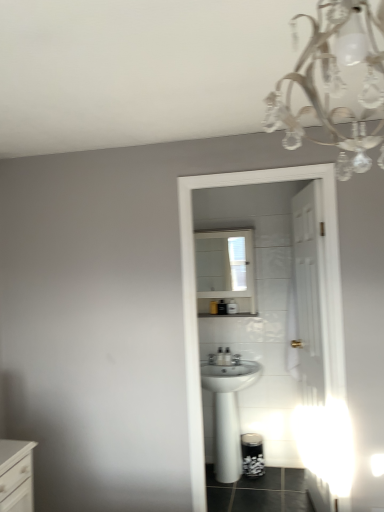
Identify the location of white glossy sink at center. (228, 411).

You are a GUI agent. You are given a task and a screenshot of the screen. Output one action in this format:
    pyautogui.click(x=<x>, y=<y>)
    Task: Click on the clear crystal chandelier at upper right
    Image resolution: width=384 pixels, height=512 pixels.
    Given the screenshot: What is the action you would take?
    pyautogui.click(x=335, y=84)

Describe the element at coordinates (16, 476) in the screenshot. I see `white glossy chest of drawers at lower left` at that location.

The height and width of the screenshot is (512, 384). What do you see at coordinates (225, 268) in the screenshot?
I see `white glossy medicine cabinet at center` at bounding box center [225, 268].

At what (x,y) coordinates should I click in order to perform the action: click on white glossy sink at center. Please return your answer as a coordinate pair (x, y). The image size is (384, 512). Looking at the image, I should click on (228, 411).

From the image's perspective, which one is positioned lower, white glossy chest of drawers at lower left or white glossy medicine cabinet at center?

white glossy chest of drawers at lower left is shown below in the image.

Is white glossy chest of drawers at lower left oriented away from white glossy medicine cabinet at center?

No, white glossy chest of drawers at lower left is not facing the opposite direction of white glossy medicine cabinet at center.

In the scene shown: Considering the relative positions of white glossy chest of drawers at lower left and white glossy medicine cabinet at center in the image provided, is white glossy chest of drawers at lower left to the right of white glossy medicine cabinet at center from the viewer's perspective?

In fact, white glossy chest of drawers at lower left is to the left of white glossy medicine cabinet at center.

Is clear crystal chandelier at upper right oriented towards white glossy medicine cabinet at center?

Yes, clear crystal chandelier at upper right is oriented towards white glossy medicine cabinet at center.

From the image's perspective, which is above, clear crystal chandelier at upper right or white glossy medicine cabinet at center?

clear crystal chandelier at upper right appears higher in the image.

Does clear crystal chandelier at upper right lie behind white glossy medicine cabinet at center?

That is False.

Considering the relative positions of clear crystal chandelier at upper right and white glossy medicine cabinet at center in the image provided, is clear crystal chandelier at upper right to the right of white glossy medicine cabinet at center from the viewer's perspective?

No, clear crystal chandelier at upper right is not to the right of white glossy medicine cabinet at center.

Who is shorter, white glossy sink at center or white glossy chest of drawers at lower left?

Standing shorter between the two is white glossy chest of drawers at lower left.

The width and height of the screenshot is (384, 512). In order to click on sink that is under the white glossy chest of drawers at lower left (from a real-world perspective) in this screenshot , I will do `click(228, 411)`.

Consider the image. In terms of size, does white glossy sink at center appear bigger or smaller than white glossy chest of drawers at lower left?

In the image, white glossy sink at center appears to be larger than white glossy chest of drawers at lower left.

Is point (223, 403) positioned in front of point (26, 476)?

No.

Is white glossy medicine cabinet at center closer to the viewer compared to white glossy chest of drawers at lower left?

No, white glossy medicine cabinet at center is behind white glossy chest of drawers at lower left.

Which object is positioned more to the left, white glossy medicine cabinet at center or white glossy chest of drawers at lower left?

Positioned to the left is white glossy chest of drawers at lower left.

Can you confirm if white glossy medicine cabinet at center is thinner than white glossy chest of drawers at lower left?

Yes.

In the scene shown: Who is taller, white glossy medicine cabinet at center or white glossy chest of drawers at lower left?

Standing taller between the two is white glossy medicine cabinet at center.

From the picture: From the image's perspective, which is above, white glossy sink at center or clear crystal chandelier at upper right?

From the image's view, clear crystal chandelier at upper right is above.

Which object is positioned more to the right, white glossy sink at center or clear crystal chandelier at upper right?

Positioned to the right is white glossy sink at center.

From a real-world perspective, between white glossy sink at center and clear crystal chandelier at upper right, who is vertically higher?

In real-world perspective, clear crystal chandelier at upper right is above.

Measure the distance between white glossy sink at center and clear crystal chandelier at upper right.

A distance of 2.34 meters exists between white glossy sink at center and clear crystal chandelier at upper right.

Is clear crystal chandelier at upper right in front of or behind white glossy sink at center in the image?

In the image, clear crystal chandelier at upper right appears in front of white glossy sink at center.

Based on the photo, is clear crystal chandelier at upper right not inside white glossy sink at center?

Yes.

Identify the location of sink below the clear crystal chandelier at upper right (from a real-world perspective). The height and width of the screenshot is (512, 384). (228, 411).

Is clear crystal chandelier at upper right taller or shorter than white glossy sink at center?

In the image, clear crystal chandelier at upper right appears to be shorter than white glossy sink at center.

How different are the orientations of white glossy medicine cabinet at center and clear crystal chandelier at upper right in degrees?

Answer: The facing directions of white glossy medicine cabinet at center and clear crystal chandelier at upper right are 179 degrees apart.

Consider the image. Which object is closer to the camera, white glossy medicine cabinet at center or clear crystal chandelier at upper right?

clear crystal chandelier at upper right is in front.

Is white glossy medicine cabinet at center spatially inside clear crystal chandelier at upper right, or outside of it?

white glossy medicine cabinet at center is spatially situated outside clear crystal chandelier at upper right.

Can you confirm if white glossy medicine cabinet at center is positioned to the left of clear crystal chandelier at upper right?

In fact, white glossy medicine cabinet at center is to the right of clear crystal chandelier at upper right.

The height and width of the screenshot is (512, 384). Find the location of `chest of drawers below the white glossy medicine cabinet at center (from a real-world perspective)`. chest of drawers below the white glossy medicine cabinet at center (from a real-world perspective) is located at coordinates (16, 476).

You are a GUI agent. You are given a task and a screenshot of the screen. Output one action in this format:
    pyautogui.click(x=<x>, y=<y>)
    Task: Click on the light fixture above the white glossy medicine cabinet at center (from the image's perspective)
    The height and width of the screenshot is (512, 384).
    Given the screenshot: What is the action you would take?
    pyautogui.click(x=335, y=84)

Looking at the image, which one is located closer to white glossy chest of drawers at lower left, clear crystal chandelier at upper right or white glossy sink at center?

Based on the image, white glossy sink at center appears to be nearer to white glossy chest of drawers at lower left.

Estimate the real-world distances between objects in this image. Which object is further from white glossy medicine cabinet at center, white glossy sink at center or white glossy chest of drawers at lower left?

Among the two, white glossy chest of drawers at lower left is located further to white glossy medicine cabinet at center.

Which object lies further to the anchor point clear crystal chandelier at upper right, white glossy chest of drawers at lower left or white glossy sink at center?

white glossy sink at center is further to clear crystal chandelier at upper right.

Estimate the real-world distances between objects in this image. Which object is further from white glossy sink at center, clear crystal chandelier at upper right or white glossy chest of drawers at lower left?

Among the two, clear crystal chandelier at upper right is located further to white glossy sink at center.

Estimate the real-world distances between objects in this image. Which object is closer to white glossy medicine cabinet at center, white glossy chest of drawers at lower left or white glossy sink at center?

The object closer to white glossy medicine cabinet at center is white glossy sink at center.

From the image, which object appears to be nearer to clear crystal chandelier at upper right, white glossy chest of drawers at lower left or white glossy medicine cabinet at center?

white glossy chest of drawers at lower left.

From the picture: Which object lies nearer to the anchor point white glossy chest of drawers at lower left, white glossy medicine cabinet at center or clear crystal chandelier at upper right?

Based on the image, clear crystal chandelier at upper right appears to be nearer to white glossy chest of drawers at lower left.

Estimate the real-world distances between objects in this image. Which object is further from clear crystal chandelier at upper right, white glossy sink at center or white glossy medicine cabinet at center?

white glossy medicine cabinet at center lies further to clear crystal chandelier at upper right than the other object.

At what (x,y) coordinates should I click in order to perform the action: click on the chest of drawers positioned between clear crystal chandelier at upper right and white glossy sink at center from near to far. Please return your answer as a coordinate pair (x, y). Looking at the image, I should click on (16, 476).

Locate an element on the screen. This screenshot has width=384, height=512. chest of drawers between clear crystal chandelier at upper right and white glossy medicine cabinet at center from front to back is located at coordinates (16, 476).

At what (x,y) coordinates should I click in order to perform the action: click on medicine cabinet located between white glossy chest of drawers at lower left and white glossy sink at center in the left-right direction. Please return your answer as a coordinate pair (x, y). This screenshot has height=512, width=384. Looking at the image, I should click on (225, 268).

Find the location of a particular element. sink positioned between clear crystal chandelier at upper right and white glossy medicine cabinet at center from near to far is located at coordinates (228, 411).